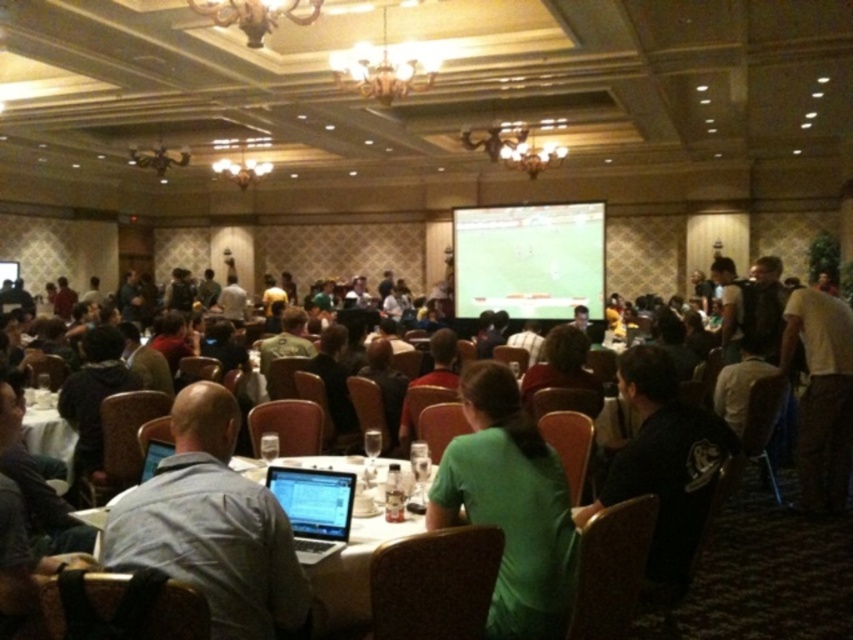
Does point (250, 493) come farther from viewer compared to point (361, 570)?

That is False.

Between gray fabric shirt at center and white glossy table at center, which one has more height?

gray fabric shirt at center

In the scene shown: Measure the distance between point (219,620) and camera.

The distance of point (219,620) from camera is 5.69 feet.

Identify the location of gray fabric shirt at center. (212, 525).

Which is in front, point (485, 484) or point (811, 307)?

Positioned in front is point (485, 484).

Where is `green matte shirt at center`? Image resolution: width=853 pixels, height=640 pixels. green matte shirt at center is located at coordinates (509, 504).

Can you confirm if black jersey at center is positioned to the right of white cotton shirt at center?

No, black jersey at center is not to the right of white cotton shirt at center.

Who is more forward, (679, 436) or (836, 300)?

Point (679, 436)

This screenshot has width=853, height=640. In order to click on black jersey at center in this screenshot , I will do [665, 464].